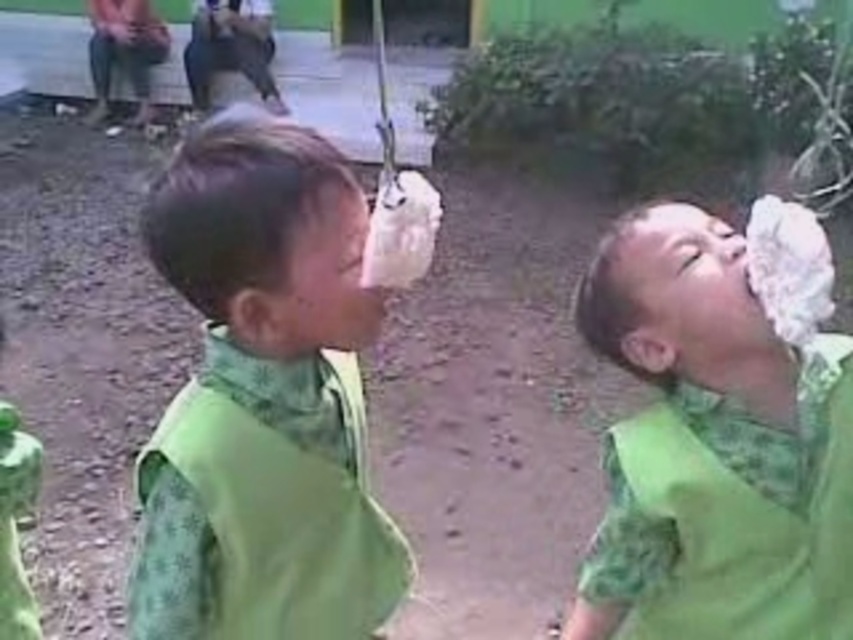
Is point (184, 294) more distant than point (816, 301)?

Yes.

Is green fabric bib at center wider than green fabric shirt at center?

In fact, green fabric bib at center might be narrower than green fabric shirt at center.

Where is `green fabric bib at center`? The image size is (853, 640). green fabric bib at center is located at coordinates (262, 397).